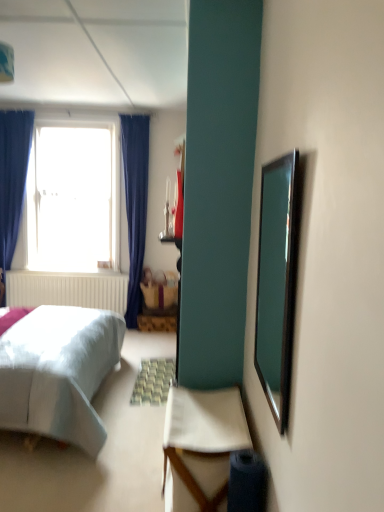
Question: Considering the relative positions of wooden picnic basket at center and clear glass mirror at right in the image provided, is wooden picnic basket at center to the left of clear glass mirror at right from the viewer's perspective?

Choices:
 (A) yes
 (B) no

Answer: (A)

Question: Can you confirm if wooden picnic basket at center is bigger than clear glass mirror at right?

Choices:
 (A) no
 (B) yes

Answer: (B)

Question: Is wooden picnic basket at center aimed at clear glass mirror at right?

Choices:
 (A) yes
 (B) no

Answer: (A)

Question: Can you confirm if wooden picnic basket at center is wider than clear glass mirror at right?

Choices:
 (A) yes
 (B) no

Answer: (A)

Question: Can you confirm if wooden picnic basket at center is taller than clear glass mirror at right?

Choices:
 (A) no
 (B) yes

Answer: (A)

Question: Are wooden picnic basket at center and clear glass mirror at right making contact?

Choices:
 (A) no
 (B) yes

Answer: (A)

Question: Does transparent glass window at upper left lie behind wooden picnic basket at center?

Choices:
 (A) no
 (B) yes

Answer: (A)

Question: Can you confirm if transparent glass window at upper left is shorter than wooden picnic basket at center?

Choices:
 (A) no
 (B) yes

Answer: (A)

Question: Are transparent glass window at upper left and wooden picnic basket at center located far from each other?

Choices:
 (A) yes
 (B) no

Answer: (A)

Question: Considering the relative sizes of transparent glass window at upper left and wooden picnic basket at center in the image provided, is transparent glass window at upper left bigger than wooden picnic basket at center?

Choices:
 (A) no
 (B) yes

Answer: (B)

Question: Considering the relative sizes of transparent glass window at upper left and wooden picnic basket at center in the image provided, is transparent glass window at upper left thinner than wooden picnic basket at center?

Choices:
 (A) yes
 (B) no

Answer: (B)

Question: Could wooden picnic basket at center be considered to be inside transparent glass window at upper left?

Choices:
 (A) yes
 (B) no

Answer: (B)

Question: Is transparent glass window at upper left at the right side of clear glass mirror at right?

Choices:
 (A) no
 (B) yes

Answer: (A)